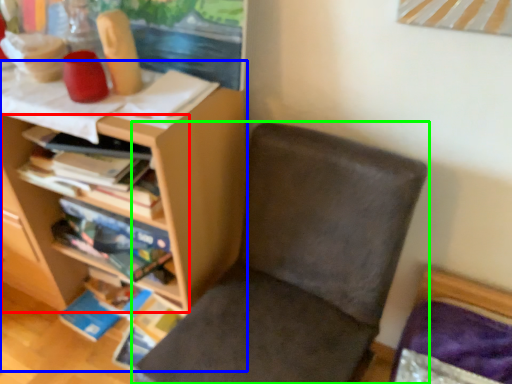
Question: Which is farther away from shelf (highlighted by a red box)? shelf (highlighted by a blue box) or chair (highlighted by a green box)?

Choices:
 (A) shelf
 (B) chair

Answer: (B)